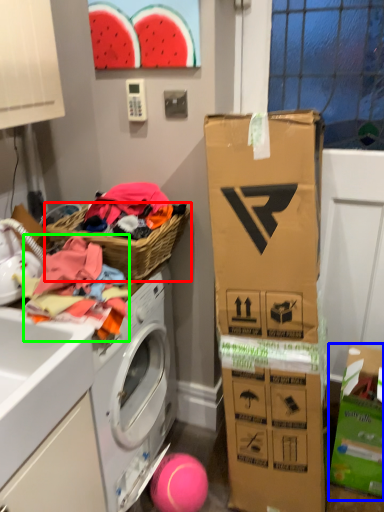
Question: Which is nearer to the picnic basket (highlighted by a red box)? cardboard box (highlighted by a blue box) or clothing (highlighted by a green box).

Choices:
 (A) cardboard box
 (B) clothing

Answer: (B)